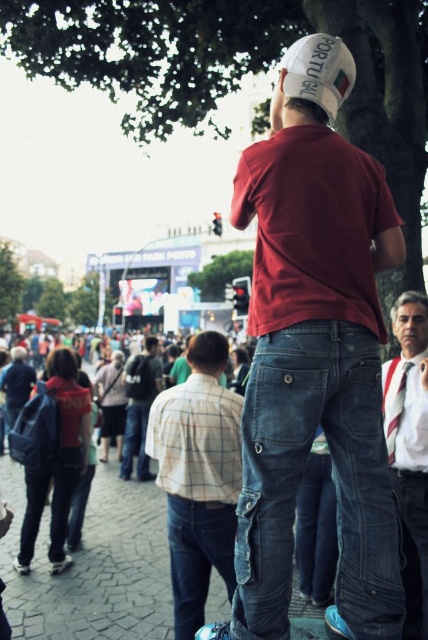
You are an event organizer checking the attire of participants. You notice a participant wearing a striped tie at center and a striped cotton shirt at lower right. According to the event dress code, all ties must be worn above the shirt collar. Is this participant complying with the dress code?

The striped tie at center is located below the striped cotton shirt at lower right, which violates the dress code requirement that ties must be worn above the shirt collar. This participant is not complying with the dress code.

From the picture: You are a photographer at the event and want to capture both the checkered shirt at center and the white fabric baseball cap at upper center in a single photo. Which object should you focus on first to ensure both are in frame?

You should focus on the checkered shirt at center first because it is larger than the white fabric baseball cap at upper center, so it will require more space in the frame.